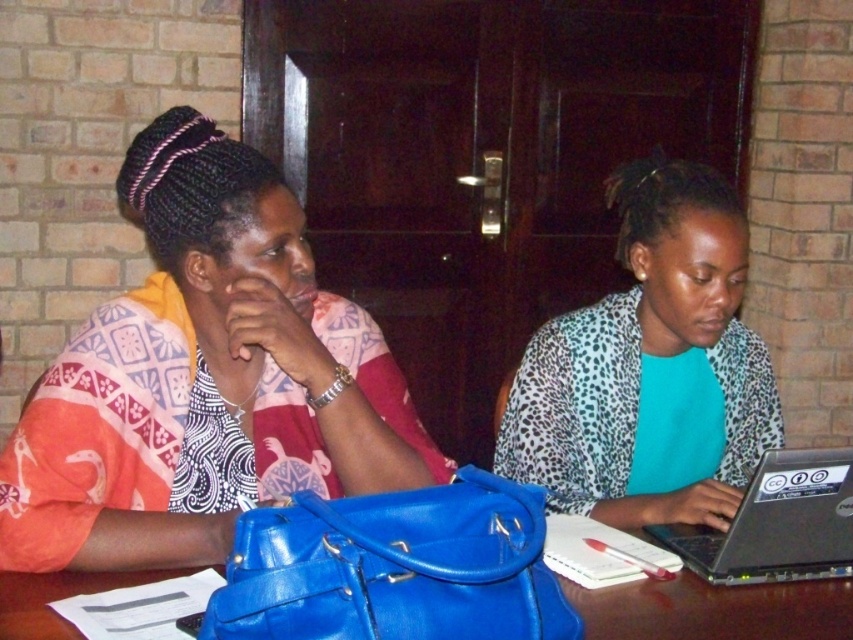
You are a fashion designer observing the two individuals in the scene. You need to determine which item has a greater width for a design project. Which object has a larger width between the matte fabric scarf at left and the leopard print blazer at right?

The matte fabric scarf at left has a larger width than the leopard print blazer at right according to the description.

You are a photographer setting up for a shoot in this room. You need to position a light to the right of the silver metallic laptop at center. Will the leopard print blazer at right block the light if placed there?

The leopard print blazer at right is to the left of the silver metallic laptop at center, so placing the light to the right of the laptop would not be blocked by the blazer.

You are an interior designer observing the two individuals in the scene. You need to determine which item, the matte fabric scarf at left or the leopard print blazer at right, is closer to the viewer. Based on their positions in the image, which one is nearer?

The leopard print blazer at right is behind the matte fabric scarf at left, so the matte fabric scarf at left is closer to the viewer.